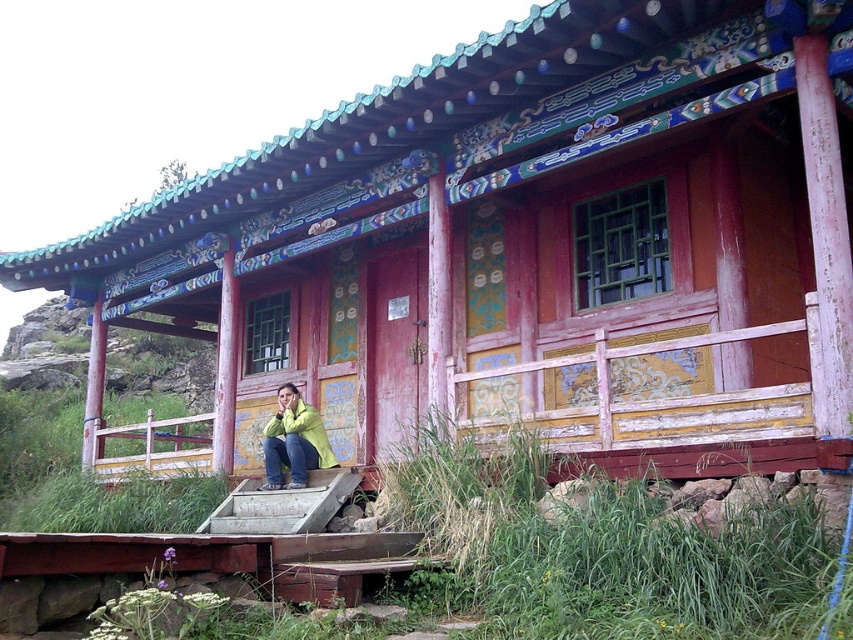
Can you confirm if wooden stairs at center is thinner than green matte jacket at lower center?

In fact, wooden stairs at center might be wider than green matte jacket at lower center.

Can you confirm if wooden stairs at center is positioned below green matte jacket at lower center?

Yes, wooden stairs at center is below green matte jacket at lower center.

Is point (347, 490) behind point (283, 408)?

No, (347, 490) is closer to viewer.

This screenshot has width=853, height=640. Find the location of `wooden stairs at center`. wooden stairs at center is located at coordinates (282, 506).